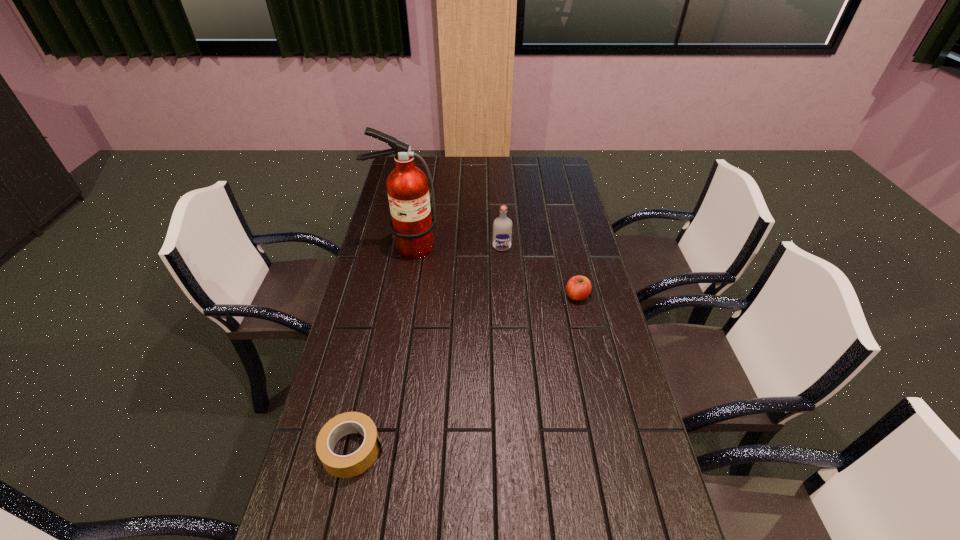
The image size is (960, 540). I want to click on fire extinguisher, so click(407, 186).

Where is `vodka`? vodka is located at coordinates (502, 226).

I want to click on the second tallest object, so click(502, 226).

Identify the location of the rightmost object. The height and width of the screenshot is (540, 960). (578, 288).

Identify the location of the third tallest object. (578, 288).

This screenshot has width=960, height=540. What are the coordinates of `the nearest object` in the screenshot? It's located at (354, 464).

Find the location of `duct tape`. duct tape is located at coordinates (354, 464).

Locate an element on the screen. free region located on the nozzle and handle of the tallest object is located at coordinates (399, 286).

You are a GUI agent. You are given a task and a screenshot of the screen. Output one action in this format:
    pyautogui.click(x=<x>, y=<y>)
    Task: Click on the free space located on the label of the third shortest object
    The image size is (960, 540).
    Given the screenshot: What is the action you would take?
    pyautogui.click(x=503, y=261)

You are a GUI agent. You are given a task and a screenshot of the screen. Output one action in this format:
    pyautogui.click(x=<x>, y=<y>)
    Task: Click on the free space located on the front of the rightmost object
    The width and height of the screenshot is (960, 540).
    Given the screenshot: What is the action you would take?
    pyautogui.click(x=598, y=389)